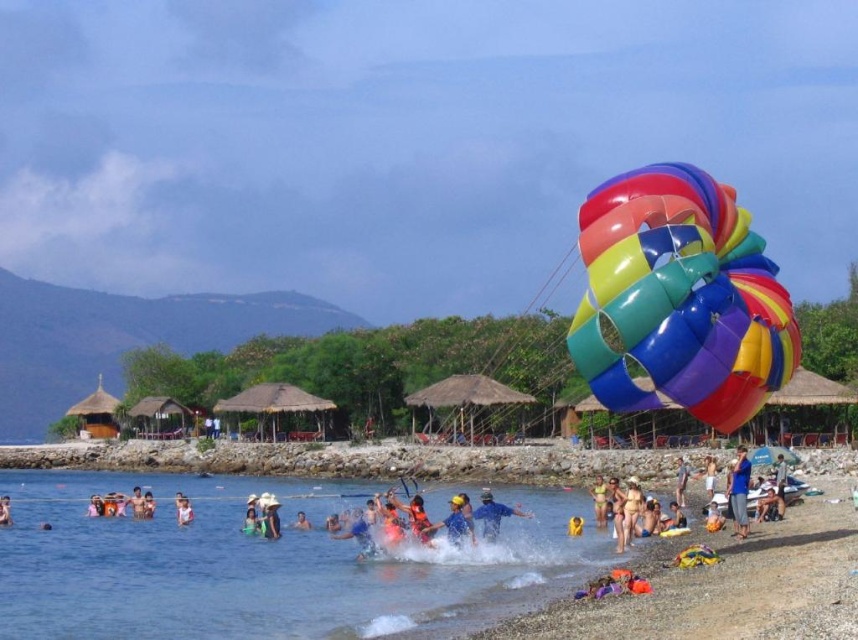
Is shiny plastic parachute at right below blue fabric swimmer at lower left?

Result: No, shiny plastic parachute at right is not below blue fabric swimmer at lower left.

Who is more distant from viewer, [600,349] or [2,525]?

The point [2,525] is more distant.

Locate an element on the screen. shiny plastic parachute at right is located at coordinates (680, 298).

How far apart are blue fabric person at center and blue fabric swimmer at lower center?

blue fabric person at center and blue fabric swimmer at lower center are 25.64 meters apart from each other.

Is point (451, 506) positioned after point (303, 529)?

No, it is in front of (303, 529).

Who is more forward, (463, 513) or (292, 525)?

Point (463, 513) is more forward.

I want to click on blue fabric person at center, so click(x=456, y=520).

Looking at this image, between blue fabric shirt at center and blue matte shirt at center, which one has less height?

blue fabric shirt at center is shorter.

Consider the image. Does blue fabric shirt at center have a lesser width compared to blue matte shirt at center?

No, blue fabric shirt at center is not thinner than blue matte shirt at center.

Is point (748, 476) positioned after point (488, 500)?

That is False.

I want to click on blue fabric shirt at center, so click(739, 492).